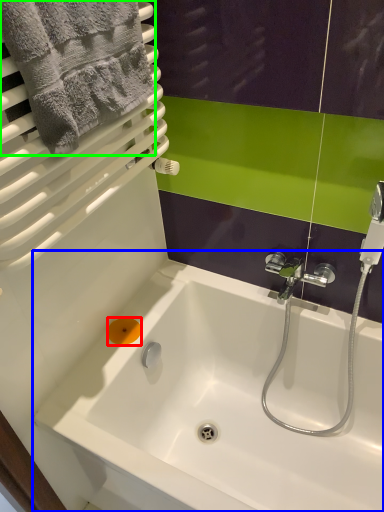
Question: Which object is the farthest from soap (highlighted by a red box)? Choose among these: bathtub (highlighted by a blue box) or towel (highlighted by a green box).

Choices:
 (A) bathtub
 (B) towel

Answer: (B)